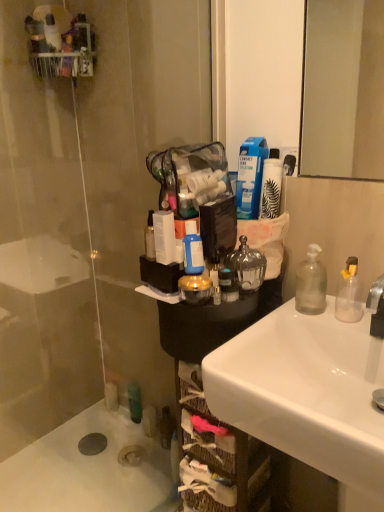
Question: Considering the relative sizes of transparent glass door at left and white glossy sink at lower right in the image provided, is transparent glass door at left taller than white glossy sink at lower right?

Choices:
 (A) yes
 (B) no

Answer: (A)

Question: Is transparent glass door at left turned away from white glossy sink at lower right?

Choices:
 (A) no
 (B) yes

Answer: (A)

Question: Does transparent glass door at left have a lesser height compared to white glossy sink at lower right?

Choices:
 (A) yes
 (B) no

Answer: (B)

Question: From a real-world perspective, is transparent glass door at left beneath white glossy sink at lower right?

Choices:
 (A) no
 (B) yes

Answer: (A)

Question: Is transparent glass door at left positioned before white glossy sink at lower right?

Choices:
 (A) no
 (B) yes

Answer: (A)

Question: Is transparent glass door at left oriented towards white glossy sink at lower right?

Choices:
 (A) no
 (B) yes

Answer: (B)

Question: Are white matte bath at lower left and blue matte bottle at center, the 1th bottle viewed from the left, located far from each other?

Choices:
 (A) yes
 (B) no

Answer: (A)

Question: Can you confirm if white matte bath at lower left is thinner than blue matte bottle at center, the 1th bottle viewed from the left?

Choices:
 (A) yes
 (B) no

Answer: (B)

Question: Considering the relative positions of white matte bath at lower left and blue matte bottle at center, which is counted as the second bottle, starting from the right, in the image provided, is white matte bath at lower left behind blue matte bottle at center, which is counted as the second bottle, starting from the right,?

Choices:
 (A) yes
 (B) no

Answer: (A)

Question: Is white matte bath at lower left shorter than blue matte bottle at center, the 1th bottle viewed from the left?

Choices:
 (A) yes
 (B) no

Answer: (A)

Question: Is white matte bath at lower left at the left side of blue matte bottle at center, which is counted as the second bottle, starting from the right?

Choices:
 (A) yes
 (B) no

Answer: (A)

Question: Considering the relative positions of white matte bath at lower left and blue matte bottle at center, the 1th bottle viewed from the left, in the image provided, is white matte bath at lower left to the right of blue matte bottle at center, the 1th bottle viewed from the left, from the viewer's perspective?

Choices:
 (A) no
 (B) yes

Answer: (A)

Question: From a real-world perspective, is white glossy sink at lower right on top of blue matte bottle at center, the 1th bottle viewed from the left?

Choices:
 (A) yes
 (B) no

Answer: (B)